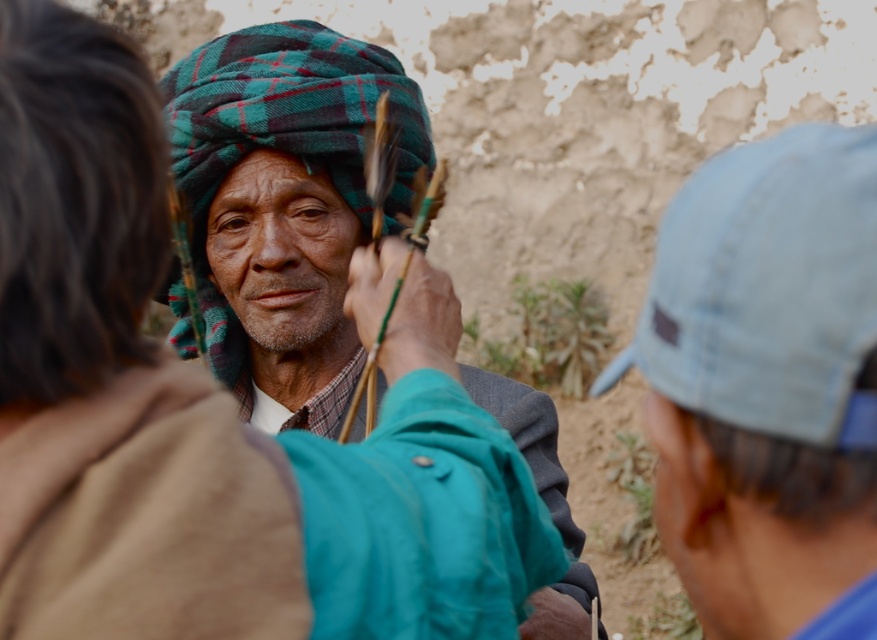
Looking at this image, you are a photographer trying to capture a portrait of the plaid wool turban at center and the light blue fabric cap at right. Which object should you focus on first if you want to ensure both are in focus, considering their positions?

The light blue fabric cap at right is above the plaid wool turban at center, so you should focus on the plaid wool turban at center first to ensure both are in focus.

You are standing in the scene and need to locate the light blue fabric cap at right. According to the coordinates provided, where would you find it?

The light blue fabric cap at right is located at point coordinates of 0.602 on the x axis and 0.876 on the y axis.